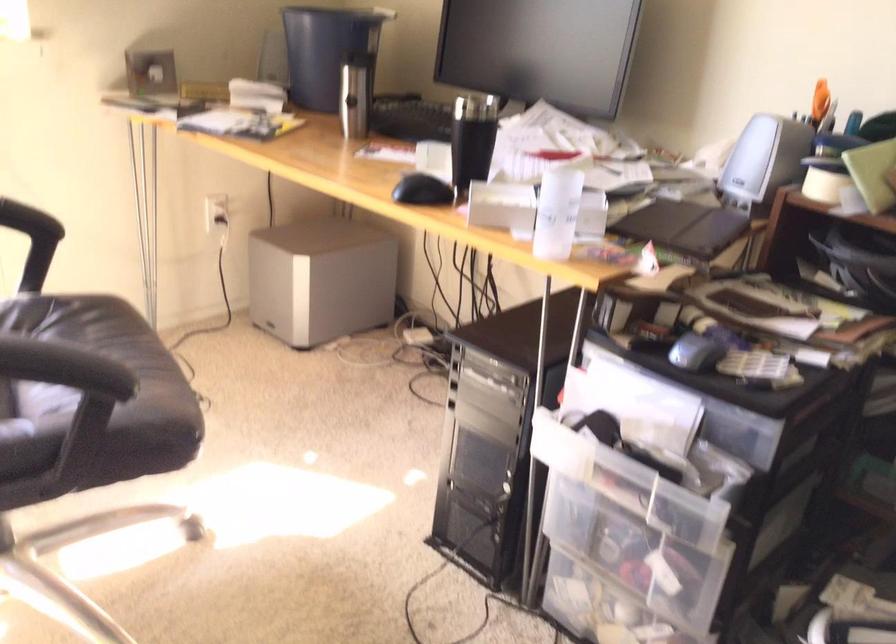
Where would you sit the chair sitting surface? Please return your answer as a coordinate pair (x, y).

(97, 389)